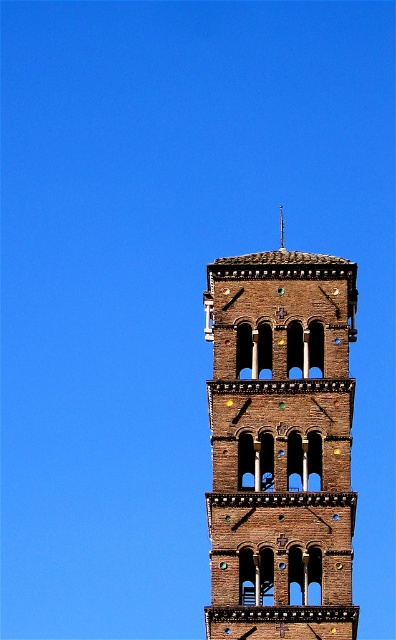
Question: Which object is farther from the camera taking this photo?

Choices:
 (A) brown brick tower at center
 (B) brown stone spire at center

Answer: (B)

Question: Is brown brick tower at center above brown stone spire at center?

Choices:
 (A) yes
 (B) no

Answer: (B)

Question: Which of the following is the farthest from the observer?

Choices:
 (A) brown brick tower at center
 (B) brown stone spire at center

Answer: (B)

Question: Which object appears farthest from the camera in this image?

Choices:
 (A) brown brick tower at center
 (B) brown stone spire at center

Answer: (B)

Question: Does brown brick tower at center appear on the left side of brown stone spire at center?

Choices:
 (A) yes
 (B) no

Answer: (A)

Question: Can you confirm if brown brick tower at center is thinner than brown stone spire at center?

Choices:
 (A) no
 (B) yes

Answer: (A)